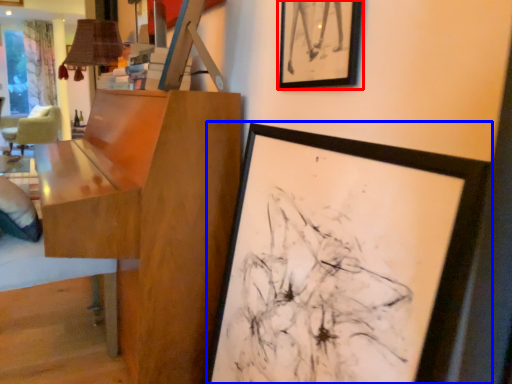
Question: Which object is further to the camera taking this photo, picture frame (highlighted by a red box) or picture frame (highlighted by a blue box)?

Choices:
 (A) picture frame
 (B) picture frame

Answer: (A)